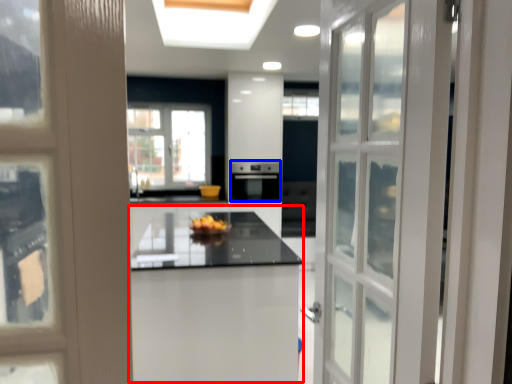
Question: Which object appears closest to the camera in this image, table (highlighted by a red box) or appliance (highlighted by a blue box)?

Choices:
 (A) table
 (B) appliance

Answer: (A)